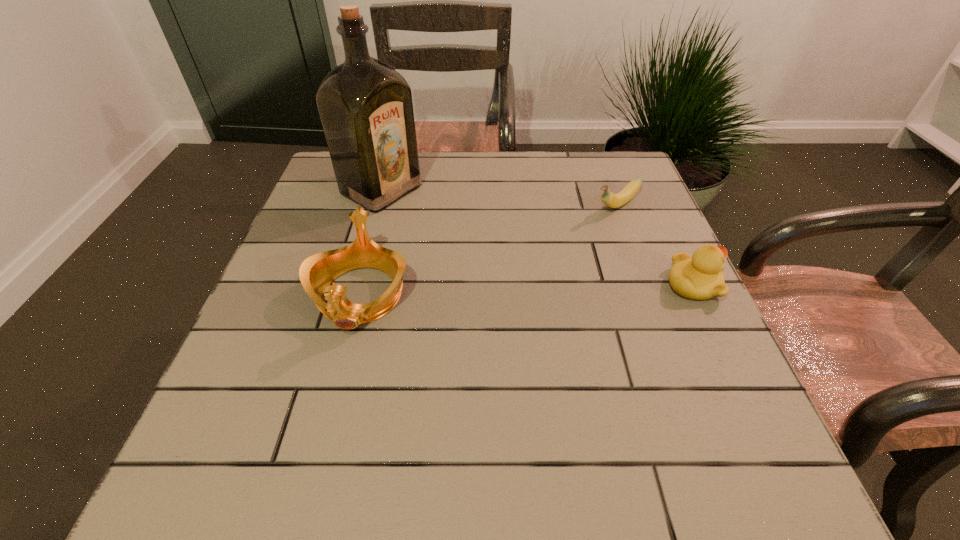
Find the location of a particular element. This screenshot has width=960, height=540. free space between the banana and the liquor is located at coordinates (499, 198).

You are a GUI agent. You are given a task and a screenshot of the screen. Output one action in this format:
    pyautogui.click(x=<x>, y=<y>)
    Task: Click on the vacant area that lies between the banana and the tallest object
    This screenshot has height=540, width=960.
    Given the screenshot: What is the action you would take?
    pyautogui.click(x=499, y=198)

I want to click on free space between the tallest object and the banana, so click(499, 198).

Where is `free area in between the banana and the duckling`? free area in between the banana and the duckling is located at coordinates (655, 245).

Where is `object that is the second nearest to the liquor`? The width and height of the screenshot is (960, 540). object that is the second nearest to the liquor is located at coordinates (628, 192).

Locate an element on the screen. Image resolution: width=960 pixels, height=540 pixels. object that is the closest to the duckling is located at coordinates click(628, 192).

The width and height of the screenshot is (960, 540). Find the location of `vacant area in the image that satisfies the following two spatial constraints: 1. on the front side of the liquor; 2. on the beak of the duckling`. vacant area in the image that satisfies the following two spatial constraints: 1. on the front side of the liquor; 2. on the beak of the duckling is located at coordinates (355, 285).